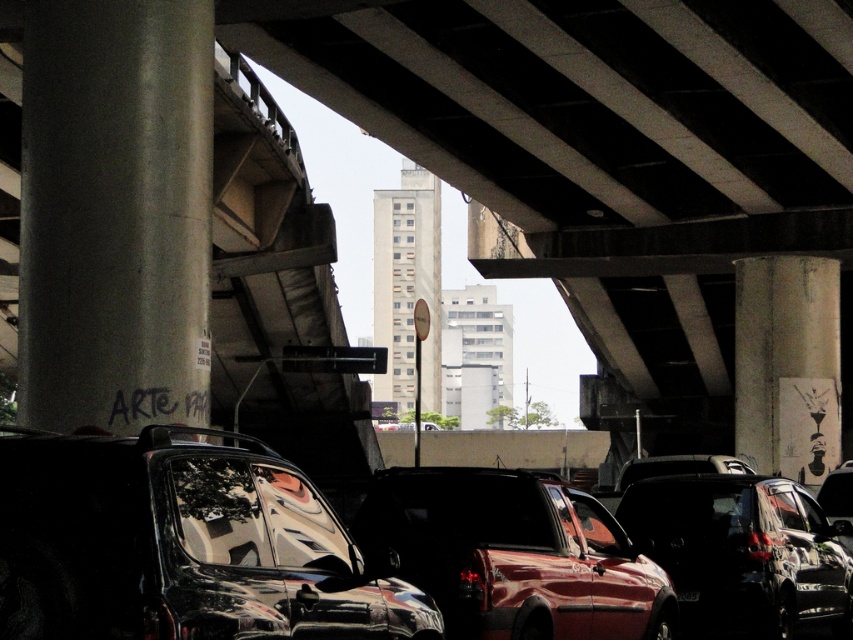
Is glossy metallic car at center below concrete textured pillar at right?

Yes, glossy metallic car at center is below concrete textured pillar at right.

Does glossy metallic car at center have a greater width compared to concrete textured pillar at right?

Indeed, glossy metallic car at center has a greater width compared to concrete textured pillar at right.

Is point (637, 484) in front of point (763, 330)?

Yes, point (637, 484) is in front of point (763, 330).

Locate an element on the screen. The image size is (853, 640). glossy metallic car at center is located at coordinates (741, 552).

Who is positioned more to the left, concrete pillar at left or glossy metallic car at center?

concrete pillar at left

From the picture: Does concrete pillar at left appear on the left side of glossy metallic car at center?

Yes, concrete pillar at left is to the left of glossy metallic car at center.

Where is `concrete pillar at left`? concrete pillar at left is located at coordinates (115, 212).

Does glossy metallic car at lower left have a lesser width compared to glossy metallic car at center?

Indeed, glossy metallic car at lower left has a lesser width compared to glossy metallic car at center.

Looking at this image, who is more forward, (10, 584) or (831, 570)?

Point (10, 584)

The image size is (853, 640). What are the coordinates of `glossy metallic car at lower left` in the screenshot? It's located at (183, 545).